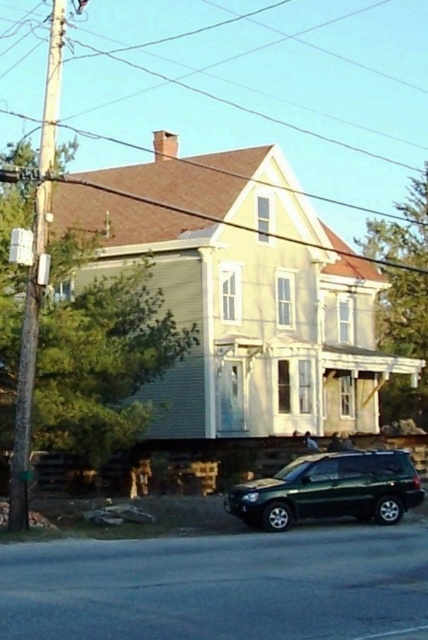
Does shiny dark green suv at lower right appear over brown wooden pole at left?

No, shiny dark green suv at lower right is not above brown wooden pole at left.

Can you confirm if shiny dark green suv at lower right is positioned to the right of brown wooden pole at left?

Correct, you'll find shiny dark green suv at lower right to the right of brown wooden pole at left.

Find the location of `shiny dark green suv at lower right`. shiny dark green suv at lower right is located at coordinates (329, 490).